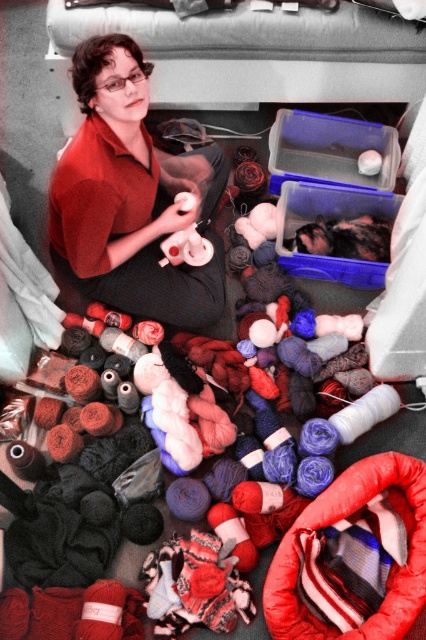
Question: From the image, what is the correct spatial relationship of matte red shirt at center in relation to translucent plastic container at center?

Choices:
 (A) left
 (B) right

Answer: (A)

Question: Is matte red shirt at center below transparent plastic container at center?

Choices:
 (A) yes
 (B) no

Answer: (A)

Question: Among these points, which one is nearest to the camera?

Choices:
 (A) (316, 120)
 (B) (144, 221)
 (C) (354, 264)

Answer: (B)

Question: Which object is closer to the camera taking this photo?

Choices:
 (A) matte red shirt at center
 (B) transparent plastic container at center

Answer: (A)

Question: Is transparent plastic container at center below translucent plastic container at center?

Choices:
 (A) no
 (B) yes

Answer: (A)

Question: Which object is positioned closest to the translucent plastic container at center?

Choices:
 (A) transparent plastic container at center
 (B) matte red shirt at center

Answer: (A)